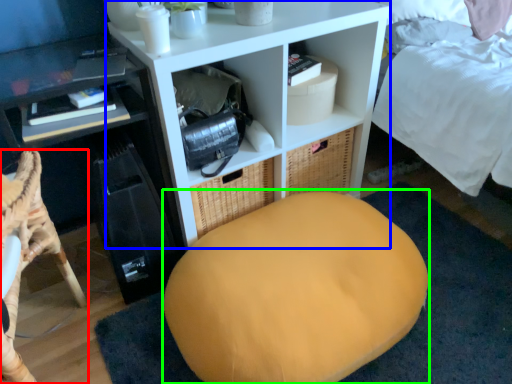
Question: Which object is positioned closest to furniture (highlighted by a red box)? Select from shelf (highlighted by a blue box) and bean bag chair (highlighted by a green box).

Choices:
 (A) shelf
 (B) bean bag chair

Answer: (B)